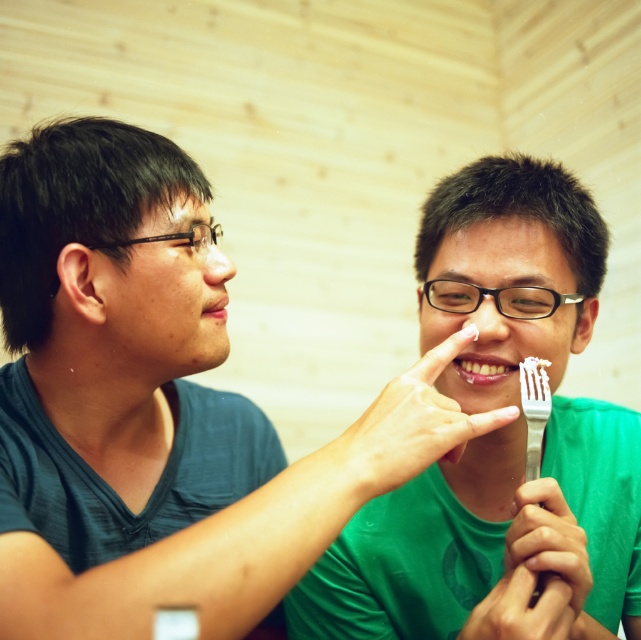
You are a dentist advising someone on proper eating habits. You notice the metallic silver fork at center and the bright white teeth at center in the image. Which object is nearer to the observer?

The metallic silver fork at center is closer to the observer than the bright white teeth at center according to the description.